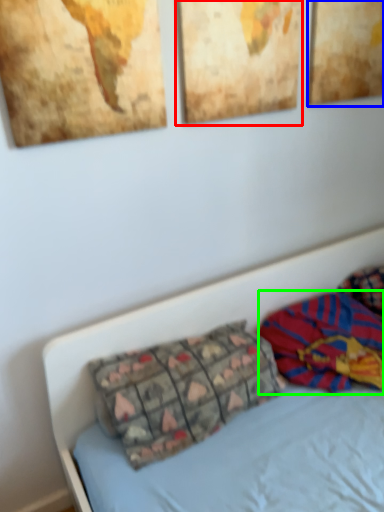
Question: Estimate the real-world distances between objects in this image. Which object is farther from picture frame (highlighted by a red box), picture frame (highlighted by a blue box) or material (highlighted by a green box)?

Choices:
 (A) picture frame
 (B) material

Answer: (B)